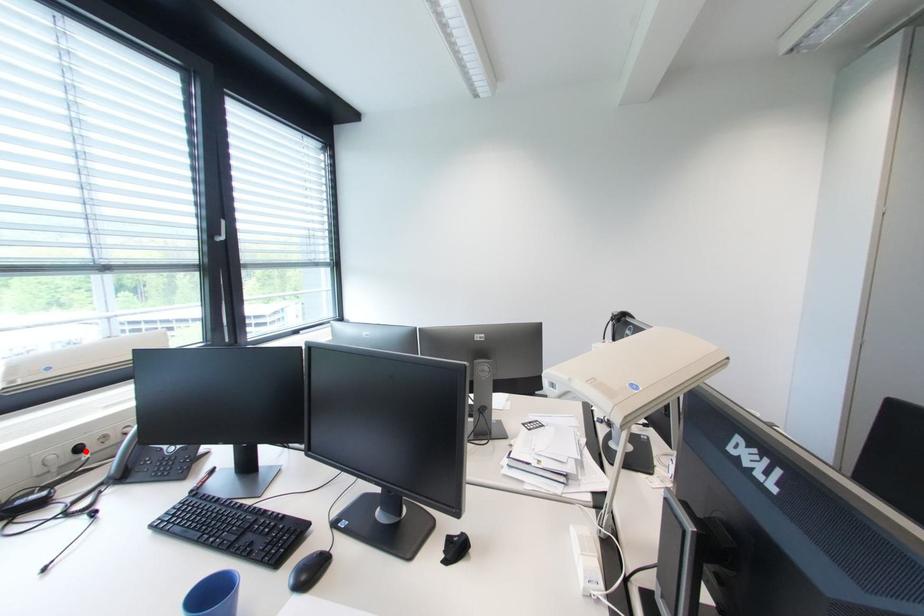
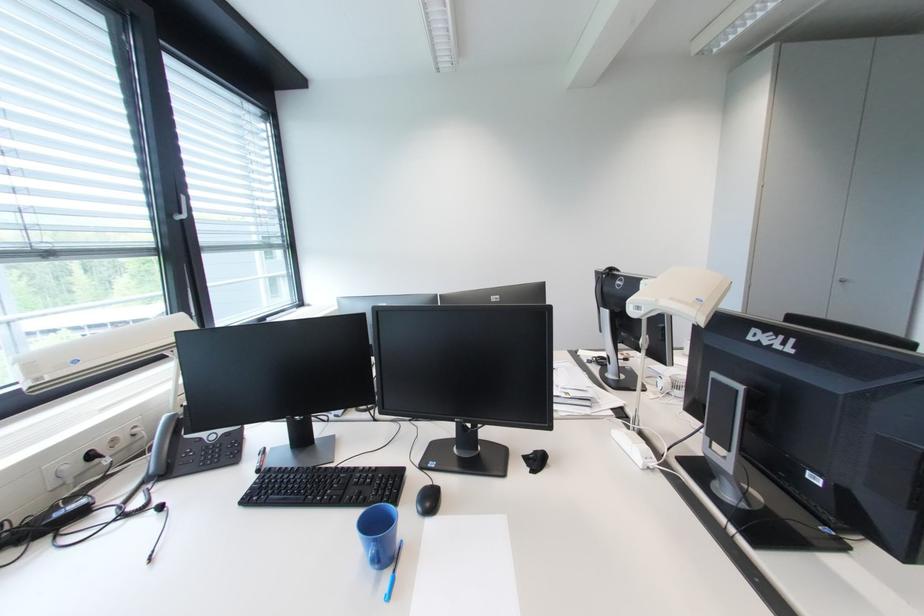
The point at the highlighted location is marked in the first image. Where is the corresponding point in the second image?

(98, 458)